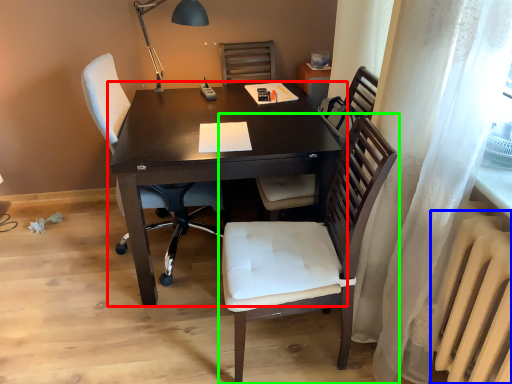
Question: Estimate the real-world distances between objects in this image. Which object is farther from desk (highlighted by a red box), radiator (highlighted by a blue box) or chair (highlighted by a green box)?

Choices:
 (A) radiator
 (B) chair

Answer: (A)